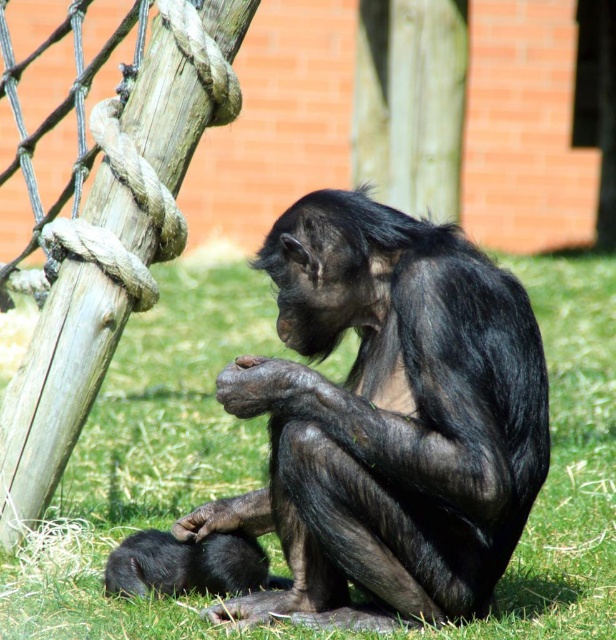
Which is more to the left, shiny black monkey at center or shiny black monkey at lower left?

shiny black monkey at lower left

How distant is shiny black monkey at center from shiny black monkey at lower left?

shiny black monkey at center and shiny black monkey at lower left are 55.45 centimeters apart from each other.

What are the coordinates of `shiny black monkey at center` in the screenshot? It's located at (387, 417).